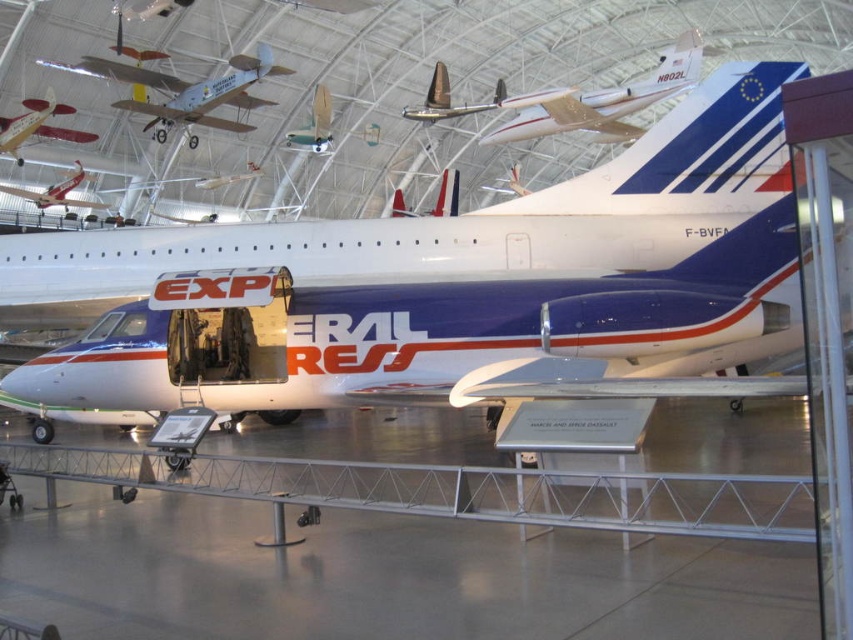
Question: Is metallic gold airplane at upper center further to camera compared to matte red airplane at upper left?

Choices:
 (A) yes
 (B) no

Answer: (B)

Question: Which object is positioned closest to the shiny silver airplane at center?

Choices:
 (A) light blue wooden biplane at upper left
 (B) metallic gold airplane at upper center
 (C) matte red airplane at upper left
 (D) metallic silver airplane at upper left

Answer: (A)

Question: Does metallic silver airplane at upper left have a greater width compared to matte white airplane at center?

Choices:
 (A) yes
 (B) no

Answer: (A)

Question: Which point is closer to the camera?

Choices:
 (A) metallic gold airplane at upper center
 (B) metallic silver sailboat at upper center

Answer: (A)

Question: Can you confirm if shiny silver airplane at center is positioned to the right of matte white airplane at center?

Choices:
 (A) no
 (B) yes

Answer: (B)

Question: Among these points, which one is farthest from the camera?

Choices:
 (A) (21, 141)
 (B) (459, 108)
 (C) (312, 115)
 (D) (401, 193)

Answer: (D)